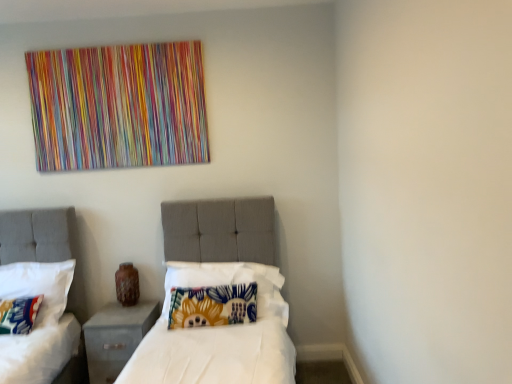
Question: Is gray fabric nightstand at lower left thinner than fluffy multicolored pillow at lower left, placed as the third pillow when sorted from right to left?

Choices:
 (A) yes
 (B) no

Answer: (B)

Question: From the image's perspective, is gray fabric nightstand at lower left located beneath fluffy multicolored pillow at lower left, arranged as the first pillow when viewed from the left?

Choices:
 (A) yes
 (B) no

Answer: (A)

Question: Does gray fabric nightstand at lower left have a greater height compared to fluffy multicolored pillow at lower left, placed as the third pillow when sorted from right to left?

Choices:
 (A) yes
 (B) no

Answer: (A)

Question: Does gray fabric nightstand at lower left have a lesser height compared to fluffy multicolored pillow at lower left, placed as the third pillow when sorted from right to left?

Choices:
 (A) yes
 (B) no

Answer: (B)

Question: From a real-world perspective, is gray fabric nightstand at lower left physically below fluffy multicolored pillow at lower left, arranged as the first pillow when viewed from the left?

Choices:
 (A) no
 (B) yes

Answer: (B)

Question: Does gray fabric nightstand at lower left contain fluffy multicolored pillow at lower left, arranged as the first pillow when viewed from the left?

Choices:
 (A) no
 (B) yes

Answer: (A)

Question: Is gray fabric nightstand at lower left aimed at floral fabric pillow at center, which appears as the first pillow when viewed from the right?

Choices:
 (A) no
 (B) yes

Answer: (A)

Question: Does gray fabric nightstand at lower left appear on the right side of floral fabric pillow at center, the third pillow positioned from the left?

Choices:
 (A) no
 (B) yes

Answer: (A)

Question: Are gray fabric nightstand at lower left and floral fabric pillow at center, which appears as the first pillow when viewed from the right, located far from each other?

Choices:
 (A) yes
 (B) no

Answer: (B)

Question: Is gray fabric nightstand at lower left bigger than floral fabric pillow at center, which appears as the first pillow when viewed from the right?

Choices:
 (A) yes
 (B) no

Answer: (A)

Question: From a real-world perspective, does gray fabric nightstand at lower left stand above floral fabric pillow at center, the third pillow positioned from the left?

Choices:
 (A) no
 (B) yes

Answer: (A)

Question: Is the position of gray fabric nightstand at lower left less distant than that of floral fabric pillow at center, the third pillow positioned from the left?

Choices:
 (A) no
 (B) yes

Answer: (A)

Question: Is fluffy multicolored pillow at lower left, arranged as the first pillow when viewed from the left, to the left of floral fabric pillow at center, the third pillow positioned from the left, from the viewer's perspective?

Choices:
 (A) yes
 (B) no

Answer: (A)